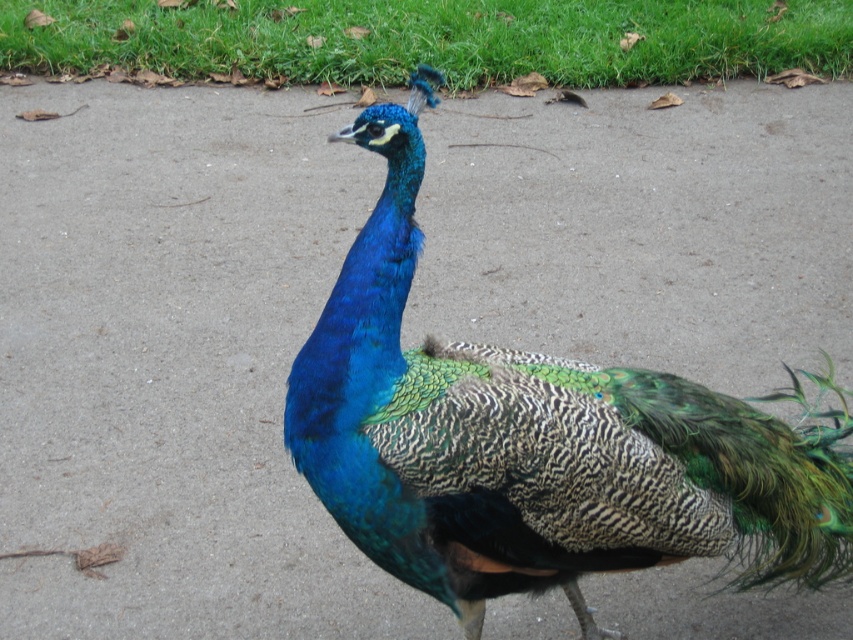
Question: Is shiny blue peacock at center further to the viewer compared to green grass at upper center?

Choices:
 (A) yes
 (B) no

Answer: (B)

Question: Which of the following is the closest to the observer?

Choices:
 (A) (573, 371)
 (B) (724, 44)

Answer: (A)

Question: Among these objects, which one is farthest from the camera?

Choices:
 (A) shiny blue peacock at center
 (B) green grass at upper center

Answer: (B)

Question: Is shiny blue peacock at center bigger than green grass at upper center?

Choices:
 (A) yes
 (B) no

Answer: (B)

Question: Does shiny blue peacock at center lie in front of green grass at upper center?

Choices:
 (A) yes
 (B) no

Answer: (A)